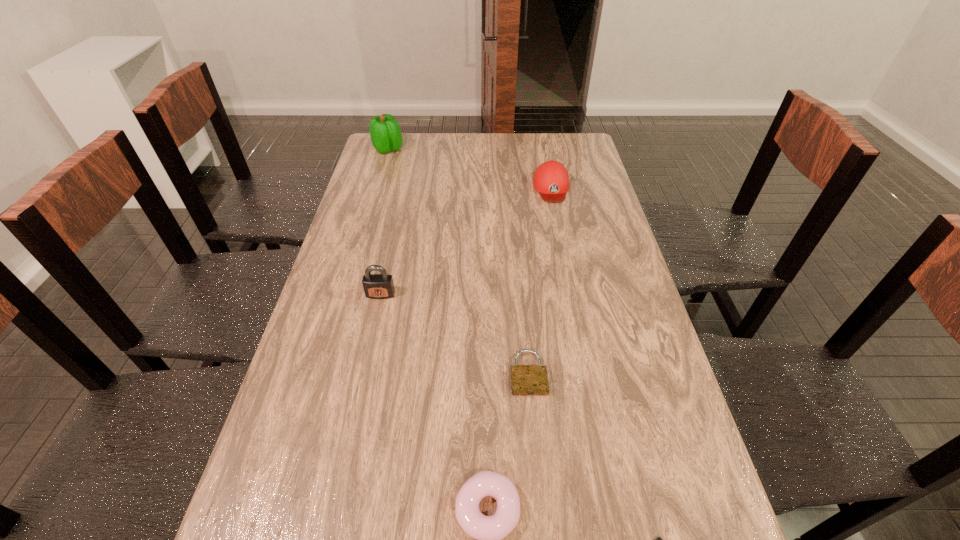
Where is `free area in between the tallest object and the nearer padlock`? Image resolution: width=960 pixels, height=540 pixels. free area in between the tallest object and the nearer padlock is located at coordinates (458, 261).

Where is `vacant region between the nearer padlock and the bell pepper`? This screenshot has height=540, width=960. vacant region between the nearer padlock and the bell pepper is located at coordinates (458, 261).

At what (x,y) coordinates should I click in order to perform the action: click on empty space between the shorter padlock and the bell pepper. Please return your answer as a coordinate pair (x, y). The width and height of the screenshot is (960, 540). Looking at the image, I should click on (458, 261).

At what (x,y) coordinates should I click in order to perform the action: click on free space between the third tallest object and the left padlock. Please return your answer as a coordinate pair (x, y). This screenshot has height=540, width=960. Looking at the image, I should click on (466, 241).

Locate an element on the screen. free space between the fifth nearest object and the fifth shortest object is located at coordinates (466, 241).

Locate which object ranks fifth in proximity to the farthest object. Please provide its 2D coordinates. Your answer should be formatted as a tuple, i.e. [(x, y)], where the tuple contains the x and y coordinates of a point satisfying the conditions above.

[(658, 539)]

At what (x,y) coordinates should I click in order to perform the action: click on object identified as the second closest to the shorter padlock. Please return your answer as a coordinate pair (x, y). The width and height of the screenshot is (960, 540). Looking at the image, I should click on (658, 539).